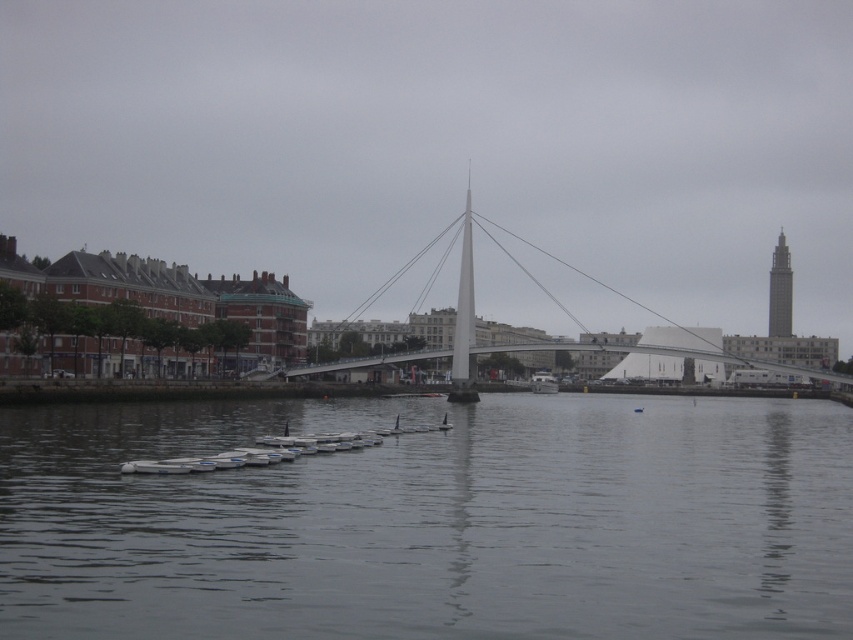
Question: Which of the following is the closest to the observer?

Choices:
 (A) (782, 236)
 (B) (349, 440)
 (C) (451, 531)
 (D) (480, 221)

Answer: (C)

Question: Which object is positioned farthest from the smooth gray tower at right?

Choices:
 (A) gray matte water at center
 (B) white plastic boat at center
 (C) white metallic suspension bridge at center

Answer: (A)

Question: Which point is farther from the camera taking this photo?

Choices:
 (A) (712, 348)
 (B) (532, 381)
 (C) (778, 316)

Answer: (C)

Question: Does gray matte water at center appear on the right side of white plastic boat at center?

Choices:
 (A) no
 (B) yes

Answer: (A)

Question: Can you confirm if gray matte water at center is smaller than white metallic suspension bridge at center?

Choices:
 (A) yes
 (B) no

Answer: (A)

Question: Is gray matte water at center to the right of smooth gray tower at right from the viewer's perspective?

Choices:
 (A) no
 (B) yes

Answer: (A)